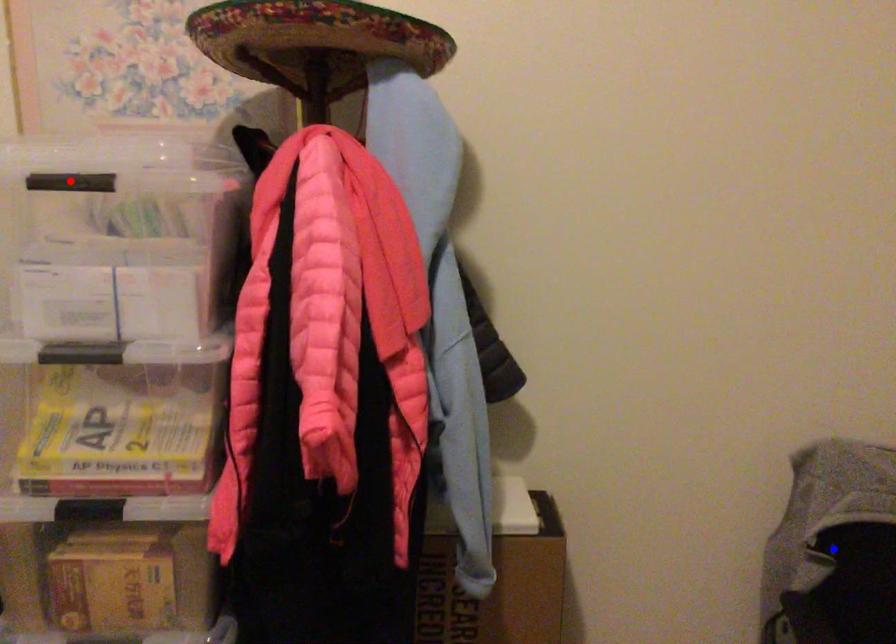
Question: In the image, two points are highlighted. Which point is nearer to the camera? Reply with the corresponding letter.

Choices:
 (A) blue point
 (B) red point

Answer: (B)